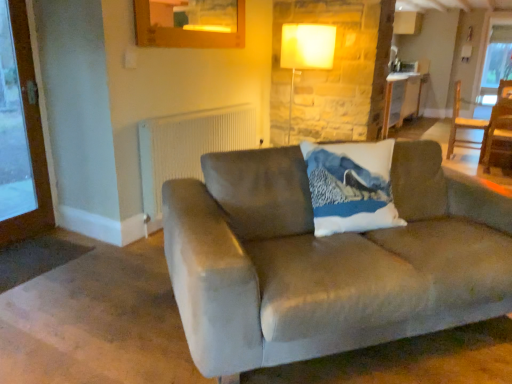
Consider the image. What is the approximate width of wooden table at center?

wooden table at center is 25.72 inches in width.

Locate an element on the screen. This screenshot has width=512, height=384. wooden chair at right is located at coordinates (463, 126).

Locate an element on the screen. This screenshot has height=384, width=512. suede couch at center is located at coordinates (328, 260).

The image size is (512, 384). Describe the element at coordinates (306, 52) in the screenshot. I see `matte white lamp at upper center` at that location.

Image resolution: width=512 pixels, height=384 pixels. I want to click on wooden screen door at left, so click(x=29, y=137).

Is wooden table at center directly adjacent to wooden screen door at left?

wooden table at center is not next to wooden screen door at left, and they're not touching.

From the picture: Which object is positioned more to the left, wooden table at center or wooden screen door at left?

From the viewer's perspective, wooden screen door at left appears more on the left side.

Which of these two, wooden table at center or wooden screen door at left, is wider?

wooden table at center.

From the image's perspective, is wooden table at center located above wooden screen door at left?

Indeed, from the image's perspective, wooden table at center is shown above wooden screen door at left.

Which of these two, suede couch at center or wooden screen door at left, is thinner?

wooden screen door at left is thinner.

Can wooden screen door at left be found inside suede couch at center?

No, wooden screen door at left is not inside suede couch at center.

From the image's perspective, is suede couch at center on wooden screen door at left?

No.

Considering the sizes of objects wooden table at center and suede couch at center in the image provided, who is thinner, wooden table at center or suede couch at center?

wooden table at center is thinner.

Is wooden table at center at the right side of suede couch at center?

Indeed, wooden table at center is positioned on the right side of suede couch at center.

Considering the points (399, 101) and (435, 219), which point is in front, point (399, 101) or point (435, 219)?

Positioned in front is point (435, 219).

Locate an element on the screen. Image resolution: width=512 pixels, height=384 pixels. studio couch below the white textured radiator at upper center (from the image's perspective) is located at coordinates (328, 260).

Would you say suede couch at center is to the left or to the right of white textured radiator at upper center in the picture?

Based on their positions, suede couch at center is located to the right of white textured radiator at upper center.

From their relative heights in the image, would you say suede couch at center is taller or shorter than white textured radiator at upper center?

Clearly, suede couch at center is shorter compared to white textured radiator at upper center.

Does wooden screen door at left turn towards matte white lamp at upper center?

No, wooden screen door at left is not turned towards matte white lamp at upper center.

Is wooden screen door at left in front of or behind matte white lamp at upper center in the image?

wooden screen door at left is positioned closer to the viewer than matte white lamp at upper center.

Is point (25, 118) closer to viewer compared to point (313, 60)?

Yes.

From the picture: How distant is wooden screen door at left from matte white lamp at upper center?

wooden screen door at left and matte white lamp at upper center are 6.77 feet apart from each other.

Is matte white lamp at upper center positioned beyond the bounds of suede couch at center?

Yes, matte white lamp at upper center is outside of suede couch at center.

Is matte white lamp at upper center taller than suede couch at center?

Correct, matte white lamp at upper center is much taller as suede couch at center.

Considering the relative positions of matte white lamp at upper center and suede couch at center in the image provided, is matte white lamp at upper center in front of suede couch at center?

No, it is not.

Considering the sizes of objects matte white lamp at upper center and suede couch at center in the image provided, who is bigger, matte white lamp at upper center or suede couch at center?

suede couch at center is bigger.

From a real-world perspective, which is physically below, wooden chair at right or wooden table at center?

From a 3D spatial view, wooden chair at right is below.

How different are the orientations of wooden chair at right and wooden table at center in degrees?

There is a 0.249-degree angle between the facing directions of wooden chair at right and wooden table at center.

Consider the image. Is wooden chair at right inside or outside of wooden table at center?

wooden chair at right exists outside the volume of wooden table at center.

The height and width of the screenshot is (384, 512). I want to click on table that is on the right side of wooden screen door at left, so click(x=401, y=98).

Locate an element on the screen. This screenshot has width=512, height=384. studio couch below the wooden screen door at left (from a real-world perspective) is located at coordinates (328, 260).

Looking at this image, based on their spatial positions, is wooden screen door at left or suede couch at center further from wooden table at center?

wooden screen door at left.

Based on their spatial positions, is matte white lamp at upper center or white textured radiator at upper center further from wooden screen door at left?

matte white lamp at upper center is positioned further to the anchor wooden screen door at left.

Which object lies nearer to the anchor point wooden chair at right, matte white lamp at upper center or white textured radiator at upper center?

matte white lamp at upper center is closer to wooden chair at right.

Estimate the real-world distances between objects in this image. Which object is further from wooden screen door at left, white textured radiator at upper center or wooden chair at right?

wooden chair at right lies further to wooden screen door at left than the other object.

Estimate the real-world distances between objects in this image. Which object is further from matte white lamp at upper center, wooden screen door at left or wooden chair at right?

wooden chair at right.

Looking at the image, which one is located further to wooden screen door at left, suede couch at center or wooden chair at right?

Among the two, wooden chair at right is located further to wooden screen door at left.

Which object lies further to the anchor point suede couch at center, white textured radiator at upper center or matte white lamp at upper center?

The object further to suede couch at center is matte white lamp at upper center.

Based on their spatial positions, is matte white lamp at upper center or wooden chair at right closer to suede couch at center?

matte white lamp at upper center.

Find the location of a particular element. This screenshot has height=384, width=512. radiator located between suede couch at center and matte white lamp at upper center in the depth direction is located at coordinates (188, 146).

Image resolution: width=512 pixels, height=384 pixels. I want to click on radiator situated between wooden screen door at left and suede couch at center from left to right, so click(188, 146).

This screenshot has height=384, width=512. What are the coordinates of `lamp between suede couch at center and wooden chair at right along the z-axis` in the screenshot? It's located at (306, 52).

Identify the location of chair located between suede couch at center and wooden table at center in the depth direction. The image size is (512, 384). (463, 126).